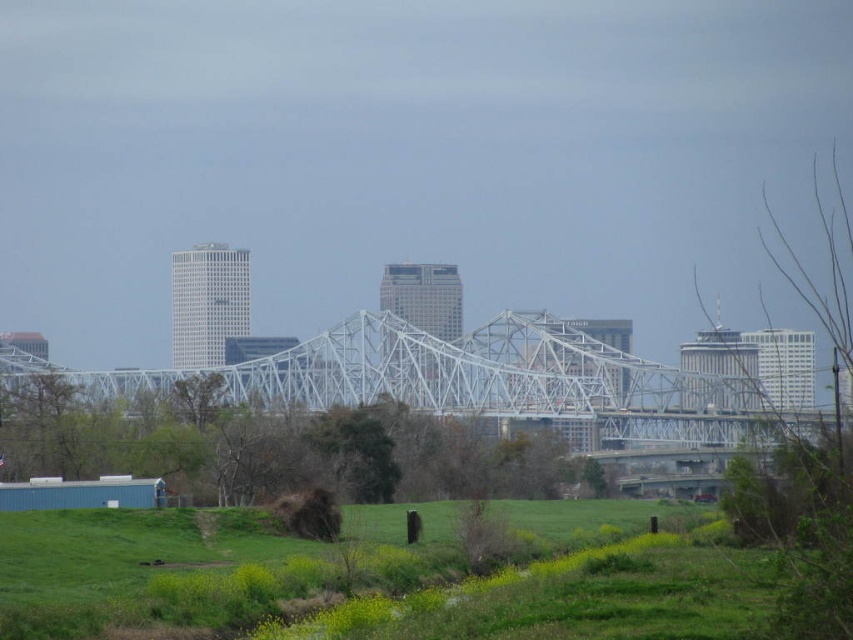
Question: Estimate the real-world distances between objects in this image. Which object is closer to the bare branches at right?

Choices:
 (A) green grassy field at lower center
 (B) white metallic bridge at center
 (C) green leafy tree at center

Answer: (A)

Question: Does green grassy field at lower center appear on the left side of bare branches at right?

Choices:
 (A) no
 (B) yes

Answer: (B)

Question: Does white metallic bridge at center have a greater width compared to bare branches at right?

Choices:
 (A) yes
 (B) no

Answer: (A)

Question: Which object is the farthest from the green grassy field at lower center?

Choices:
 (A) bare branches at right
 (B) green leafy tree at center

Answer: (B)

Question: Considering the real-world distances, which object is closest to the bare branches at right?

Choices:
 (A) green grassy field at lower center
 (B) green leafy tree at center

Answer: (A)

Question: Is green leafy tree at center below bare branches at right?

Choices:
 (A) yes
 (B) no

Answer: (A)